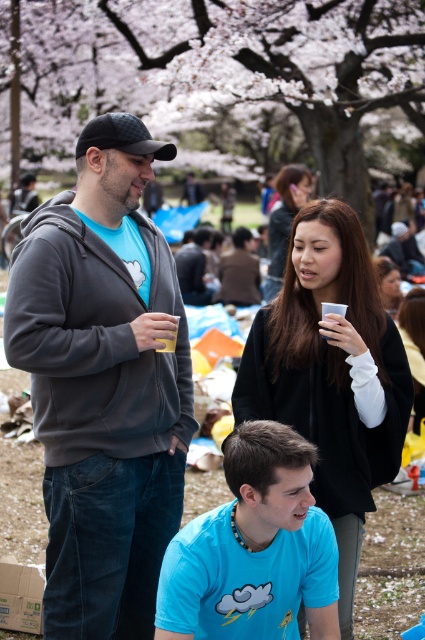
Please describe the location of the matte black hair at center in the image using coordinates. The coordinate system is normalized, with the origin at the bottom left corner of the image. The x and y axes are measured in fractions of the image width and height respectively. The answer should be in the format of coordinates in parentheses with two decimal places, e.g., 0.34,0.67.

The coordinates of the matte black hair at center are approximately (284, 224).

You are a photographer trying to capture a candid shot of the matte black hair at center and the dark gray hoodie at center. Your camera has a maximum focus range of 2 meters. Can you capture both subjects in focus without moving closer?

The matte black hair at center is 2.37 meters away from the dark gray hoodie at center. Since the distance between them exceeds the camera maximum focus range of 2 meters, you cannot capture both subjects in focus without moving closer.